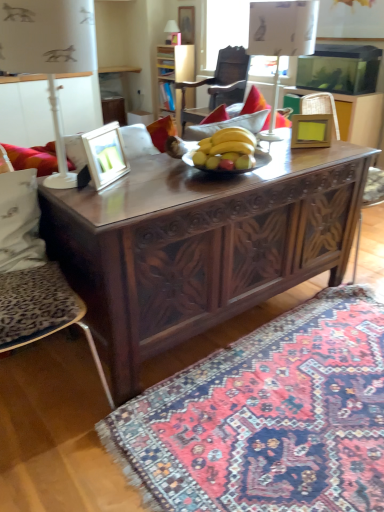
The image size is (384, 512). I want to click on free point above carpet with intricate patterns at lower right (from a real-world perspective), so click(304, 399).